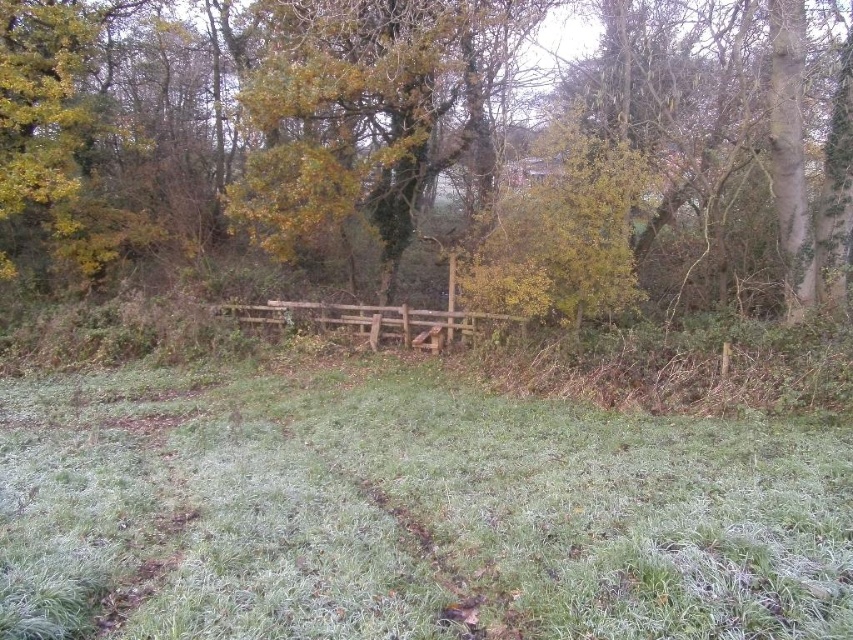
In the scene shown: You are standing in the middle of the scene and want to take a photo of the green grassy at center and the green leafy tree at center. Which object will appear closer to the camera in the photo?

The green grassy at center will appear closer to the camera because it is positioned under the green leafy tree at center, meaning it is in a lower plane relative to the camera.

You are standing at the point marked as point (407, 513) in the image. What is the condition of the grassy area at that location?

The point (407, 513) indicates green grassy at center, so the grassy area at that location is green and healthy.